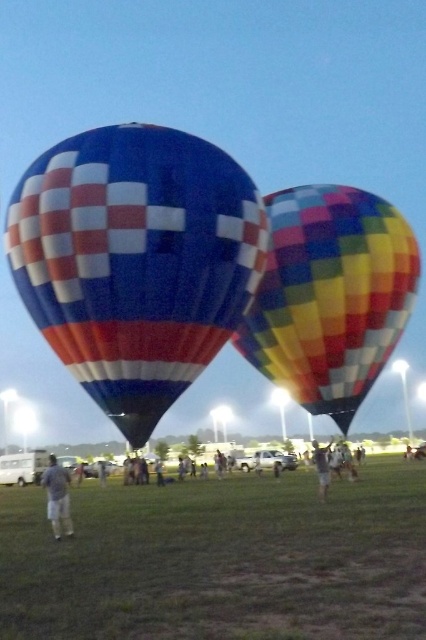
Question: Estimate the real-world distances between objects in this image. Which object is farther from the green grass at lower center?

Choices:
 (A) gray fabric shorts at lower left
 (B) blue glossy hot air balloon at center

Answer: (B)

Question: Can you confirm if green grass at lower center is thinner than blue glossy hot air balloon at center?

Choices:
 (A) yes
 (B) no

Answer: (B)

Question: Which point appears closest to the camera in this image?

Choices:
 (A) (316, 449)
 (B) (388, 284)
 (C) (126, 176)

Answer: (C)

Question: Which of the following is the farthest from the observer?

Choices:
 (A) gray fabric shorts at lower left
 (B) green grass at lower center

Answer: (A)

Question: Can you confirm if green grass at lower center is smaller than gray fabric shorts at lower left?

Choices:
 (A) yes
 (B) no

Answer: (B)

Question: Considering the relative positions of green grass at lower center and denim shorts at center in the image provided, where is green grass at lower center located with respect to denim shorts at center?

Choices:
 (A) above
 (B) below

Answer: (A)